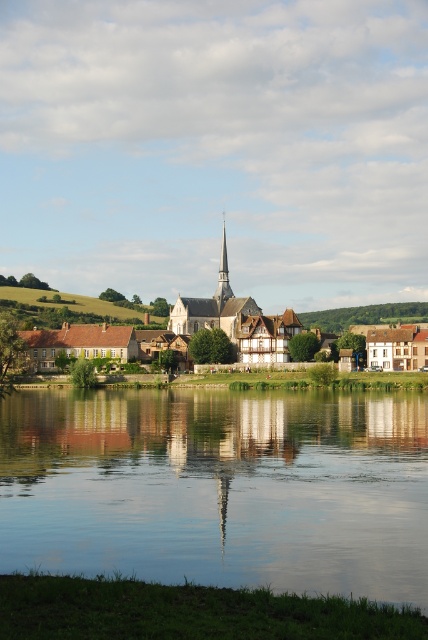
Can you confirm if transparent glass water at center is positioned to the left of smooth white spire at center?

Correct, you'll find transparent glass water at center to the left of smooth white spire at center.

Who is taller, transparent glass water at center or smooth white spire at center?

smooth white spire at center

Does point (400, 400) come closer to viewer compared to point (225, 294)?

Yes, it is.

You are a GUI agent. You are given a task and a screenshot of the screen. Output one action in this format:
    pyautogui.click(x=<x>, y=<y>)
    Task: Click on the transparent glass water at center
    The height and width of the screenshot is (640, 428).
    Given the screenshot: What is the action you would take?
    pyautogui.click(x=219, y=486)

Which is below, transparent glass water at center or white wooden church at center?

transparent glass water at center

From the picture: Can you confirm if transparent glass water at center is shorter than white wooden church at center?

Yes.

What are the coordinates of `transparent glass water at center` in the screenshot? It's located at (219, 486).

Looking at this image, who is more forward, (407,358) or (234,352)?

Point (407,358)

At what (x,y) coordinates should I click in order to perform the action: click on white wooden houses at center. Please return your answer as a coordinate pair (x, y). Looking at the image, I should click on (226, 330).

Locate an element on the screen. white wooden houses at center is located at coordinates (226, 330).